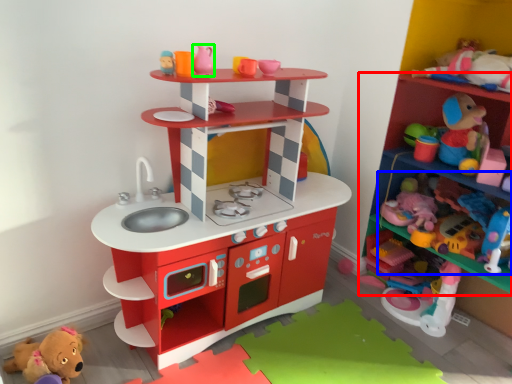
Question: Which object is positioned closest to shelf (highlighted by a red box)? Select from toy (highlighted by a blue box) and toy (highlighted by a green box).

Choices:
 (A) toy
 (B) toy

Answer: (A)